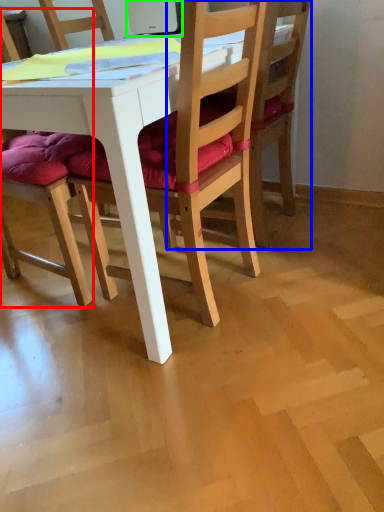
Question: Which is nearer to the chair (highlighted by a red box)? chair (highlighted by a blue box) or laptop (highlighted by a green box).

Choices:
 (A) chair
 (B) laptop

Answer: (A)